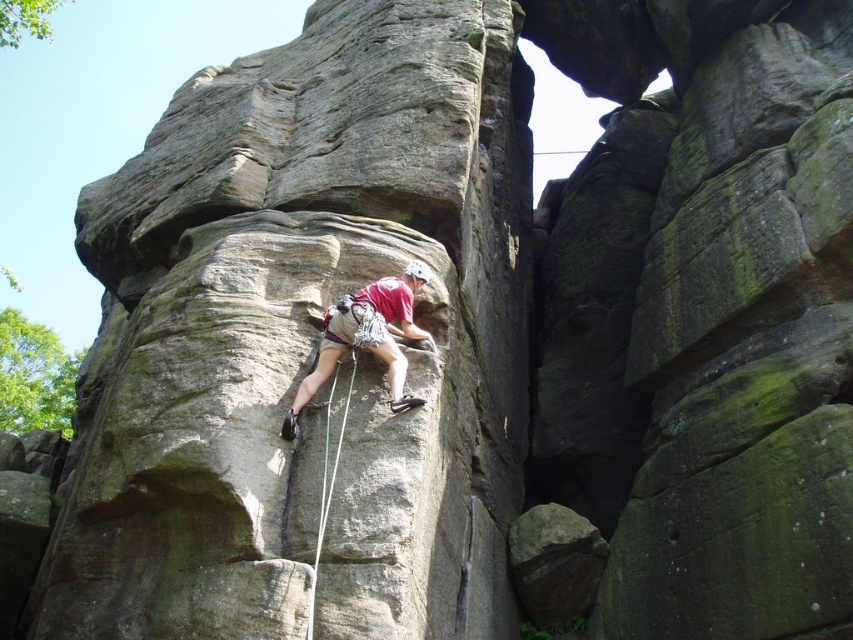
Is point (380, 333) closer to camera compared to point (326, 445)?

No, (380, 333) is behind (326, 445).

Where is `matte gray rock climber at center`? This screenshot has width=853, height=640. matte gray rock climber at center is located at coordinates (367, 337).

Find the location of a particular element. matte gray rock climber at center is located at coordinates (367, 337).